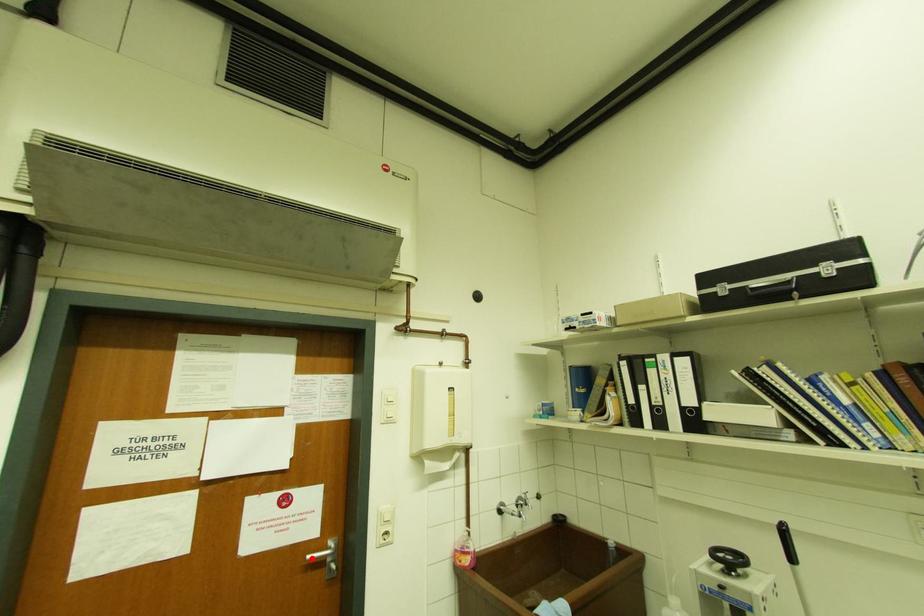
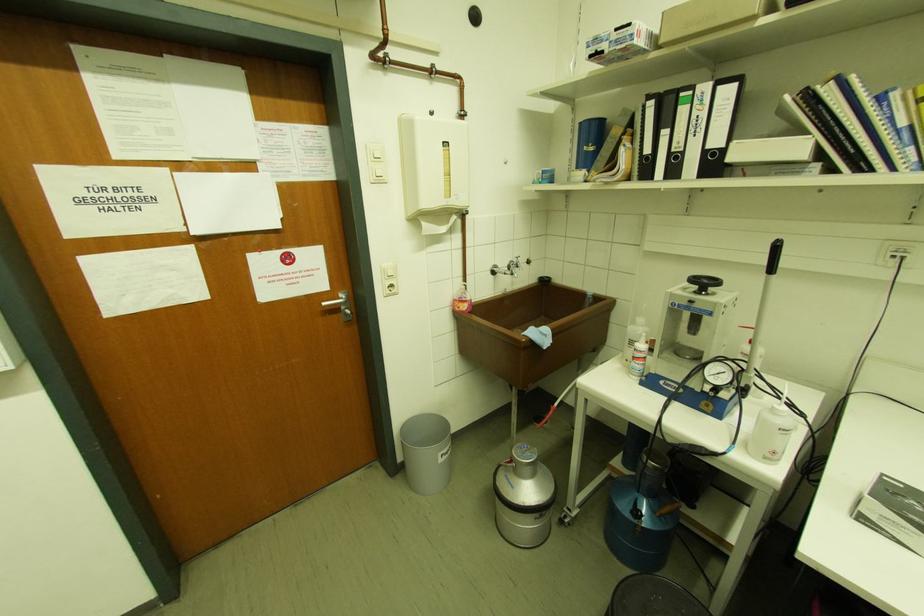
Where in the second image is the point corresponding to the highlighted location from the first image?

(326, 305)